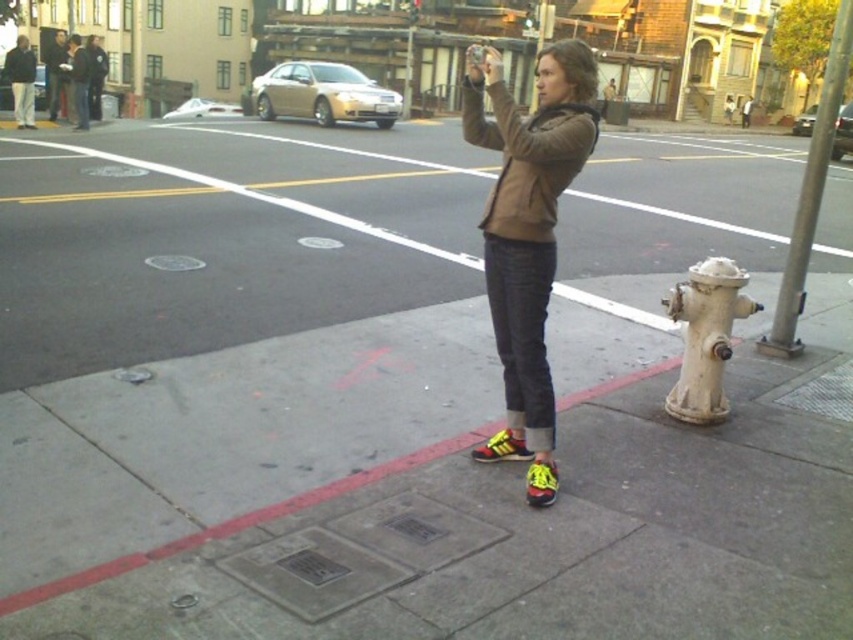
You are a photographer trying to capture a shot of the yellow synthetic shoe at center. You notice the red concrete curb at lower center is blocking part of the view. Which direction should you move to get the curb out of the frame?

Move to the right side since the red concrete curb at lower center is on the left of the yellow synthetic shoe at center, so shifting right would position the shoe away from the curb.

You are a delivery person who needs to place a small package on the sidewalk between the white matte hydrant at lower right and the yellow synthetic shoe at center. Can you fit the package there without blocking either object?

The white matte hydrant at lower right might be wider than the yellow synthetic shoe at center, so there might not be enough space between them to place the package without blocking one of them.

You are a photographer trying to capture a clear shot of the yellow suede shoe at lower center without the red concrete curb at lower center blocking the view. Given their sizes, which object should you move closer to or farther away from to achieve this?

Since the red concrete curb at lower center is larger than the yellow suede shoe at lower center, you should move closer to the yellow suede shoe at lower center. This will make the shoe appear larger in the frame while reducing the curb size relative to the shoe, ensuring the shoe is the main focus without obstruction.